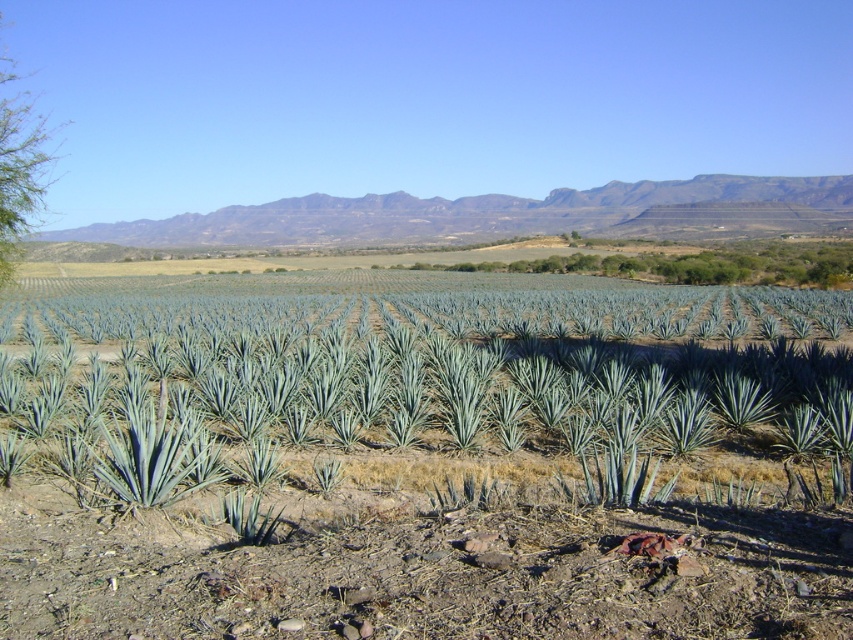
Question: Based on their relative distances, which object is nearer to the green leafy tree at center?

Choices:
 (A) rugged brown mountains at upper center
 (B) green leafy tree at left

Answer: (A)

Question: Among these points, which one is nearest to the camera?

Choices:
 (A) (32, 193)
 (B) (340, 224)
 (C) (757, 280)

Answer: (A)

Question: Is rugged brown mountains at upper center closer to camera compared to green leafy tree at left?

Choices:
 (A) no
 (B) yes

Answer: (A)

Question: Does rugged brown mountains at upper center lie in front of green leafy tree at center?

Choices:
 (A) yes
 (B) no

Answer: (B)

Question: Which point is closer to the camera?

Choices:
 (A) rugged brown mountains at upper center
 (B) green leafy tree at left

Answer: (B)

Question: Is rugged brown mountains at upper center smaller than green leafy tree at center?

Choices:
 (A) no
 (B) yes

Answer: (A)